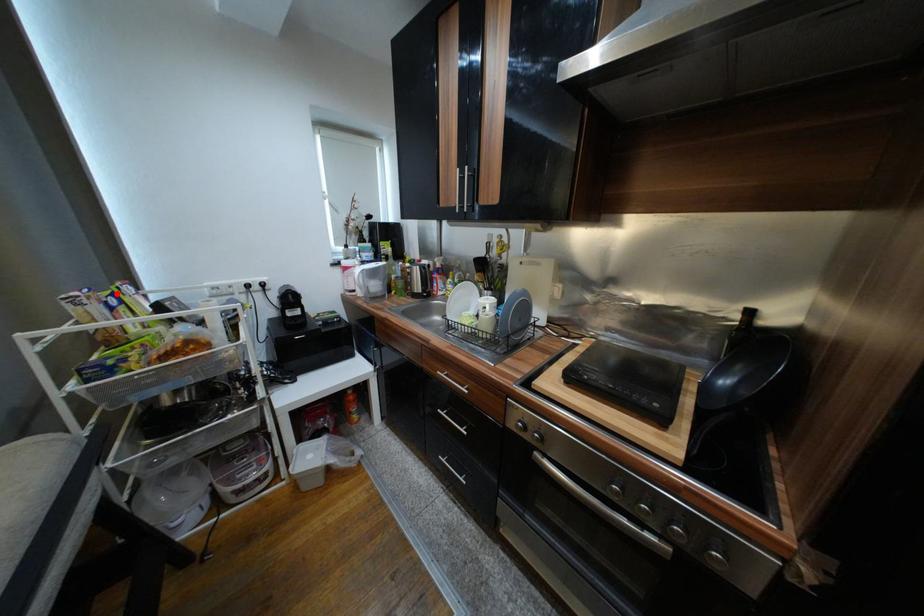
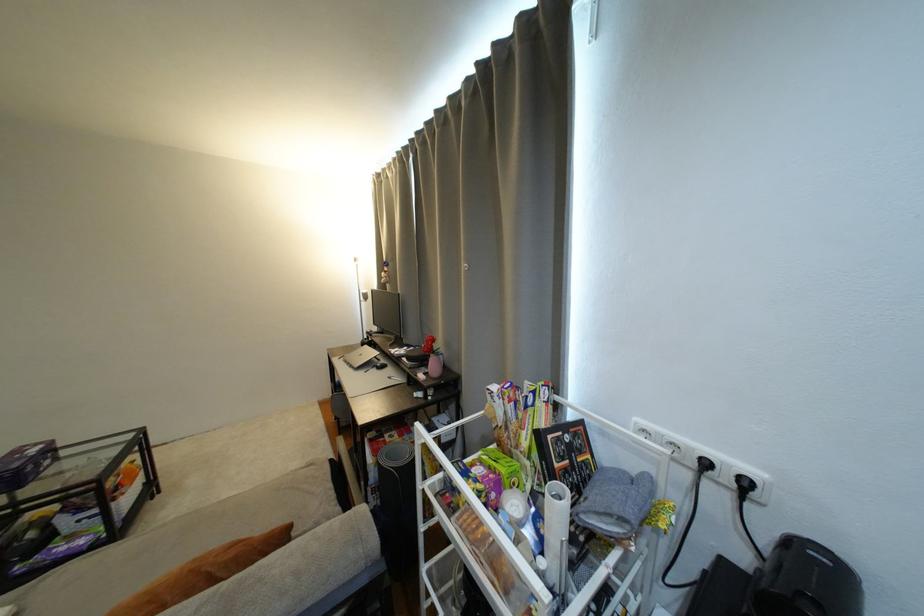
In the second image, find the point that corresponds to the highlighted location in the first image.

(541, 390)